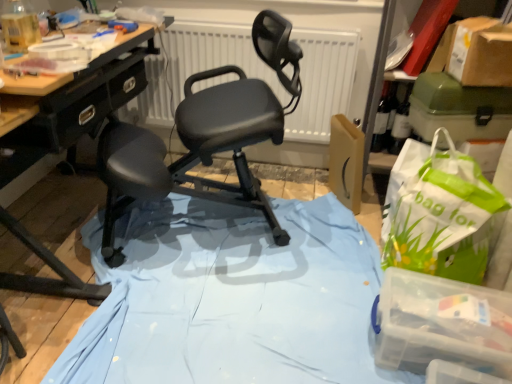
Question: Is green plastic box at upper right, which is the second box in front-to-back order, taller than transparent plastic container at lower right, the first box ordered from the bottom?

Choices:
 (A) yes
 (B) no

Answer: (A)

Question: From the image's perspective, does green plastic box at upper right, which is the second box in front-to-back order, appear higher than transparent plastic container at lower right, which is counted as the 2th box, starting from the top?

Choices:
 (A) no
 (B) yes

Answer: (B)

Question: Is green plastic box at upper right, which is the second box in front-to-back order, facing away from transparent plastic container at lower right, which is counted as the 2th box, starting from the top?

Choices:
 (A) no
 (B) yes

Answer: (A)

Question: Does green plastic box at upper right, which is the first box in back-to-front order, have a smaller size compared to transparent plastic container at lower right, which is counted as the 2th box, starting from the top?

Choices:
 (A) yes
 (B) no

Answer: (A)

Question: From the image's perspective, is green plastic box at upper right, which is the second box in front-to-back order, located beneath transparent plastic container at lower right, which is counted as the 2th box, starting from the top?

Choices:
 (A) yes
 (B) no

Answer: (B)

Question: From a real-world perspective, is matte glass bottle at upper right physically located above or below white matte radiator at center?

Choices:
 (A) above
 (B) below

Answer: (B)

Question: Considering the positions of matte glass bottle at upper right and white matte radiator at center in the image, is matte glass bottle at upper right wider or thinner than white matte radiator at center?

Choices:
 (A) wide
 (B) thin

Answer: (A)

Question: Considering their positions, is matte glass bottle at upper right located in front of or behind white matte radiator at center?

Choices:
 (A) front
 (B) behind

Answer: (A)

Question: Visually, is matte glass bottle at upper right positioned to the left or to the right of white matte radiator at center?

Choices:
 (A) right
 (B) left

Answer: (A)

Question: Considering the positions of matte black chair at center and green plastic box at upper right, which is the second box in front-to-back order, in the image, is matte black chair at center wider or thinner than green plastic box at upper right, which is the second box in front-to-back order,?

Choices:
 (A) thin
 (B) wide

Answer: (B)

Question: Based on their positions, is matte black chair at center located to the left or right of green plastic box at upper right, which is the second box in front-to-back order?

Choices:
 (A) left
 (B) right

Answer: (A)

Question: From the image's perspective, relative to green plastic box at upper right, which is the second box in front-to-back order, is matte black chair at center above or below?

Choices:
 (A) below
 (B) above

Answer: (A)

Question: From their relative heights in the image, would you say matte black chair at center is taller or shorter than green plastic box at upper right, the 2th box in the bottom-to-top sequence?

Choices:
 (A) tall
 (B) short

Answer: (A)

Question: Would you say light blue fabric at center is inside or outside green plastic box at upper right, which is the second box in front-to-back order?

Choices:
 (A) inside
 (B) outside

Answer: (B)

Question: Considering their positions, is light blue fabric at center located in front of or behind green plastic box at upper right, which is the first box from top to bottom?

Choices:
 (A) front
 (B) behind

Answer: (A)